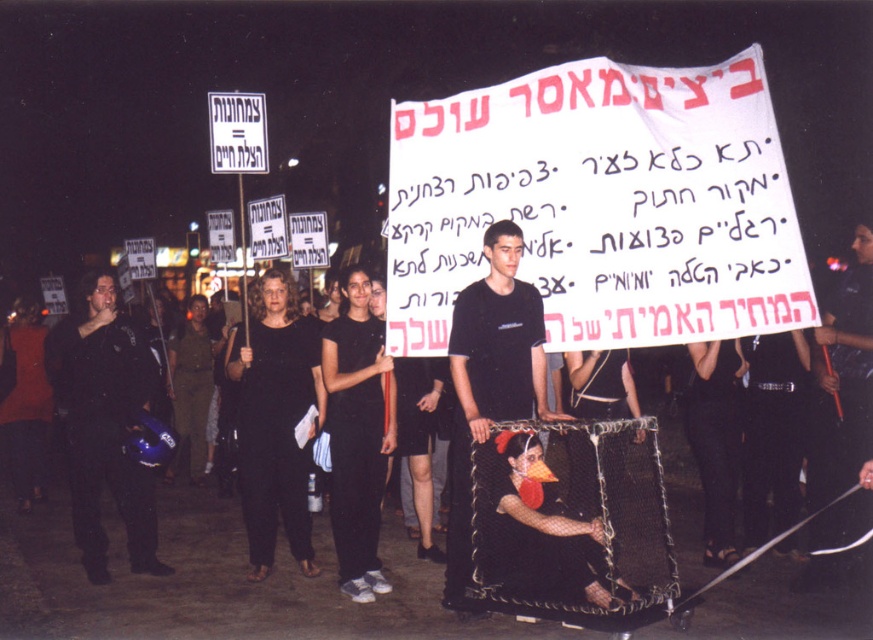
Based on the photo, between black matte helmet at left and black matte shirt at center, which one appears on the left side from the viewer's perspective?

black matte helmet at left

Does point (80, 362) come farther from viewer compared to point (498, 260)?

Yes, it is behind point (498, 260).

Between point (67, 384) and point (459, 429), which one is positioned in front?

Point (459, 429) is more forward.

You are a GUI agent. You are given a task and a screenshot of the screen. Output one action in this format:
    pyautogui.click(x=<x>, y=<y>)
    Task: Click on the black matte helmet at left
    
    Given the screenshot: What is the action you would take?
    pyautogui.click(x=104, y=426)